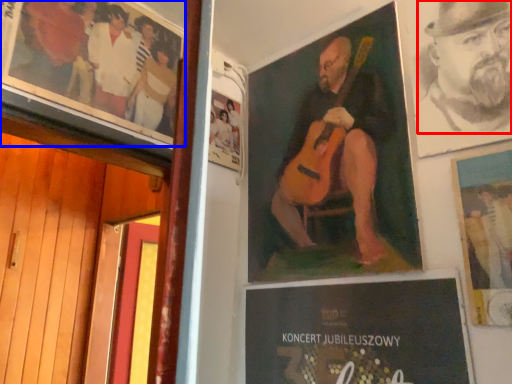
Question: Which object appears closest to the camera in this image, person (highlighted by a red box) or poster (highlighted by a blue box)?

Choices:
 (A) person
 (B) poster

Answer: (A)